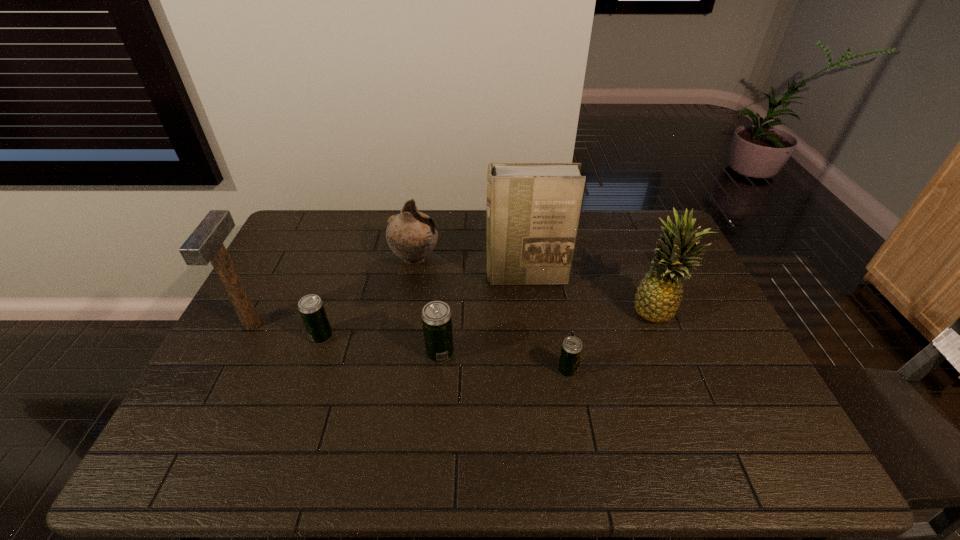
Identify the location of empty location between the mallet and the fourth shortest object. The width and height of the screenshot is (960, 540). (333, 292).

Identify the location of free spot between the rightmost beer can and the rightmost object. The width and height of the screenshot is (960, 540). (612, 340).

Identify the location of vacant space that's between the pottery and the rightmost beer can. The image size is (960, 540). (492, 315).

Where is `free spot between the phonebook and the rightmost beer can`? The width and height of the screenshot is (960, 540). free spot between the phonebook and the rightmost beer can is located at coordinates pyautogui.click(x=546, y=324).

Locate an element on the screen. free space between the third shortest object and the phonebook is located at coordinates (483, 315).

You are a GUI agent. You are given a task and a screenshot of the screen. Output one action in this format:
    pyautogui.click(x=<x>, y=<y>)
    Task: Click on the object that is the fifth closest to the third shortest object
    This screenshot has height=540, width=960.
    Given the screenshot: What is the action you would take?
    pyautogui.click(x=205, y=244)

This screenshot has height=540, width=960. I want to click on object that is the fourth closest to the mallet, so click(x=533, y=209).

Image resolution: width=960 pixels, height=540 pixels. Find the location of `beer can that is the closest to the tallest beer can`. beer can that is the closest to the tallest beer can is located at coordinates (311, 308).

At what (x,y) coordinates should I click in order to perform the action: click on beer can identified as the closest to the phonebook. Please return your answer as a coordinate pair (x, y). Image resolution: width=960 pixels, height=540 pixels. Looking at the image, I should click on (436, 316).

Identify the location of free space that satisfies the following two spatial constraints: 1. on the cover of the rightmost beer can; 2. on the left side of the phonebook. (537, 370).